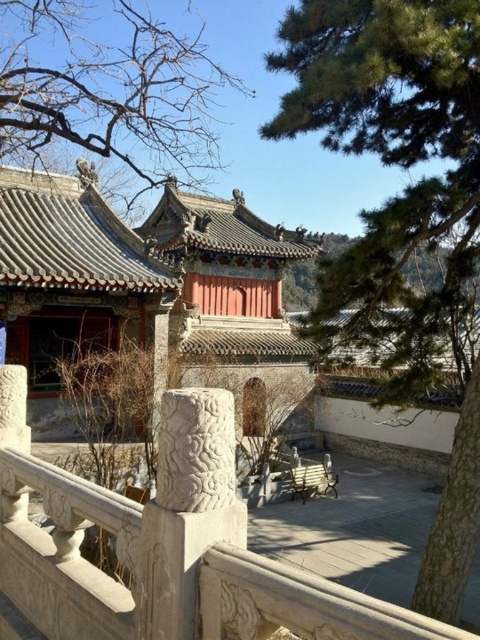
Who is positioned more to the left, matte gray stone palace at center or white stone balustrade at center?

matte gray stone palace at center

Is point (242, 332) farther from viewer compared to point (59, 516)?

Yes, it is behind point (59, 516).

This screenshot has width=480, height=640. What do you see at coordinates (134, 275) in the screenshot?
I see `matte gray stone palace at center` at bounding box center [134, 275].

The image size is (480, 640). What are the coordinates of `matte gray stone palace at center` in the screenshot? It's located at (134, 275).

Which is in front, point (452, 64) or point (165, 445)?

Point (165, 445) is in front.

Between green textured tree at upper right and white stone pillar at center, which one is positioned lower?

white stone pillar at center is lower down.

Between point (392, 291) and point (205, 472), which one is positioned behind?

The point (392, 291) is more distant.

The width and height of the screenshot is (480, 640). Find the location of `green textured tree at upper right`. green textured tree at upper right is located at coordinates (391, 156).

Is point (443, 330) behind point (10, 573)?

Yes.

Who is positioned more to the right, green textured tree at upper right or white stone balustrade at center?

Positioned to the right is green textured tree at upper right.

Which is behind, point (328, 116) or point (105, 627)?

Positioned behind is point (328, 116).

The height and width of the screenshot is (640, 480). In order to click on green textured tree at upper right in this screenshot , I will do `click(391, 156)`.